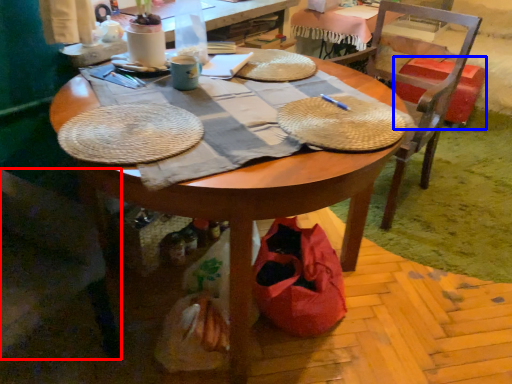
Question: Which point is further to the camera, chair (highlighted by a red box) or trash bin/can (highlighted by a blue box)?

Choices:
 (A) chair
 (B) trash bin/can

Answer: (B)